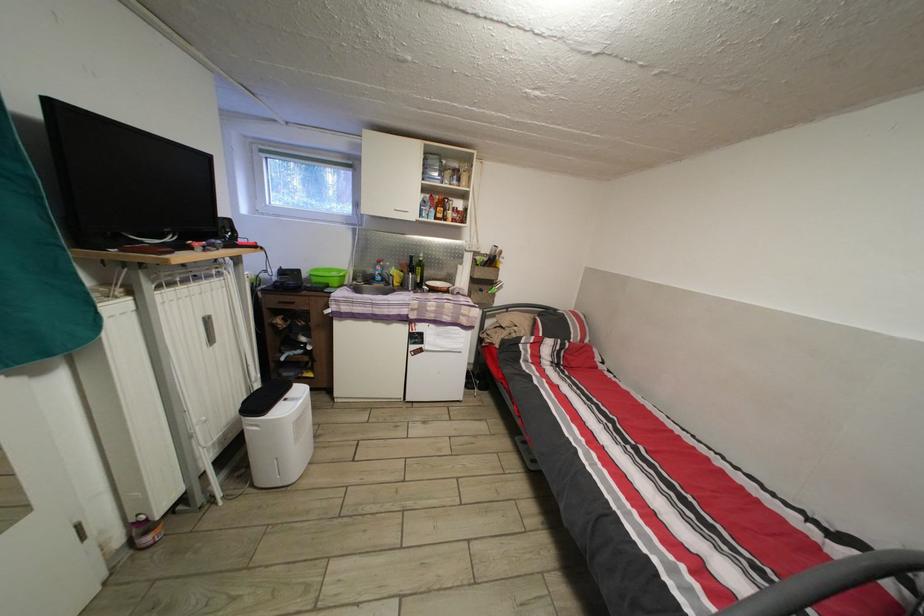
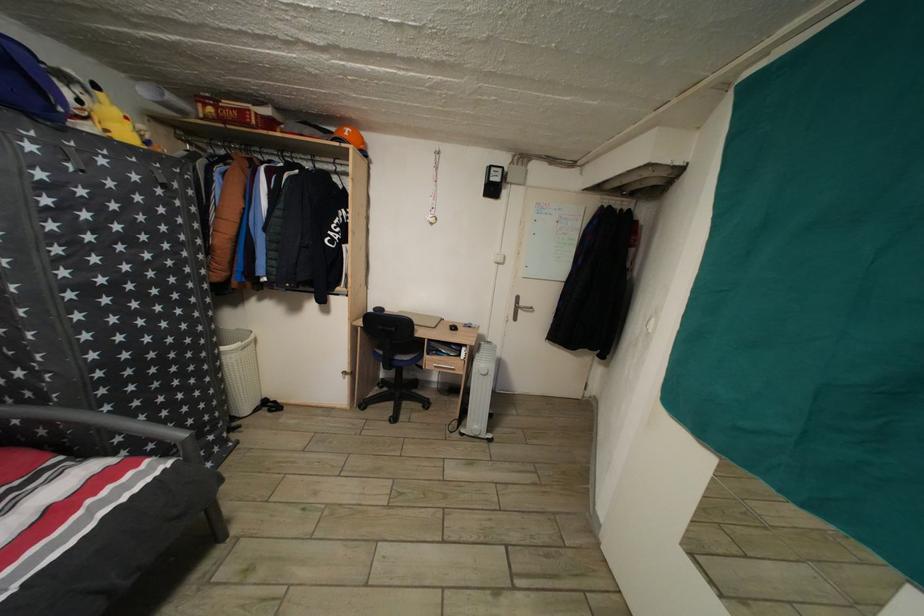
The point at (689, 573) is marked in the first image. Where is the corresponding point in the second image?

(96, 508)